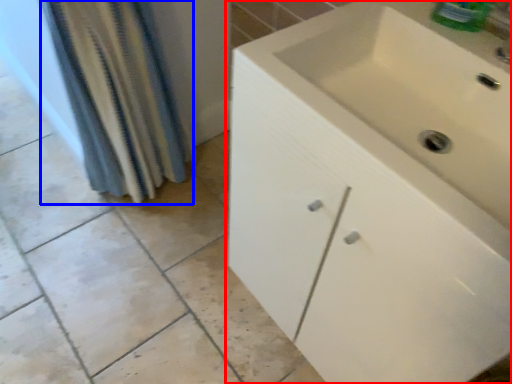
Question: Which of the following is the closest to the observer, bathroom cabinet (highlighted by a red box) or shower curtain (highlighted by a blue box)?

Choices:
 (A) bathroom cabinet
 (B) shower curtain

Answer: (A)